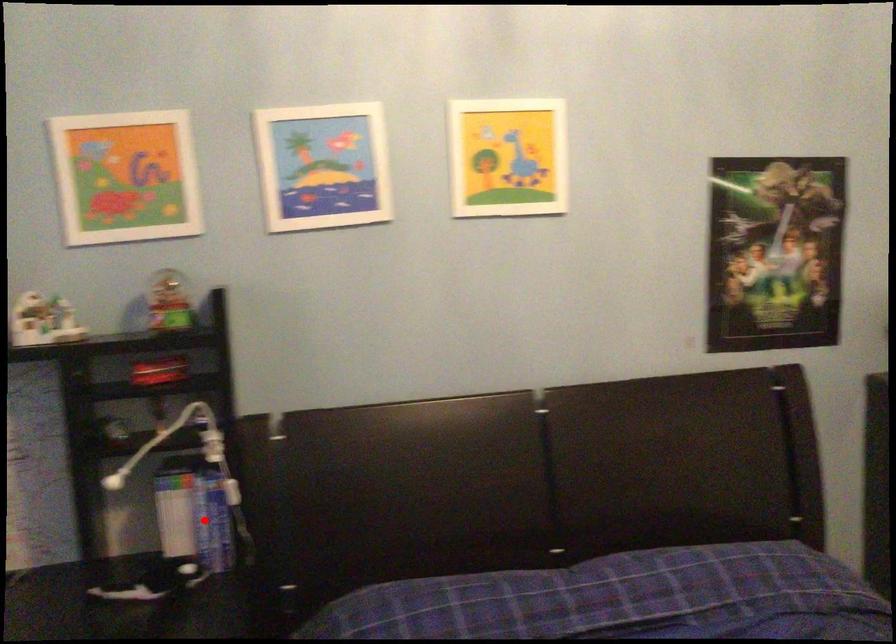
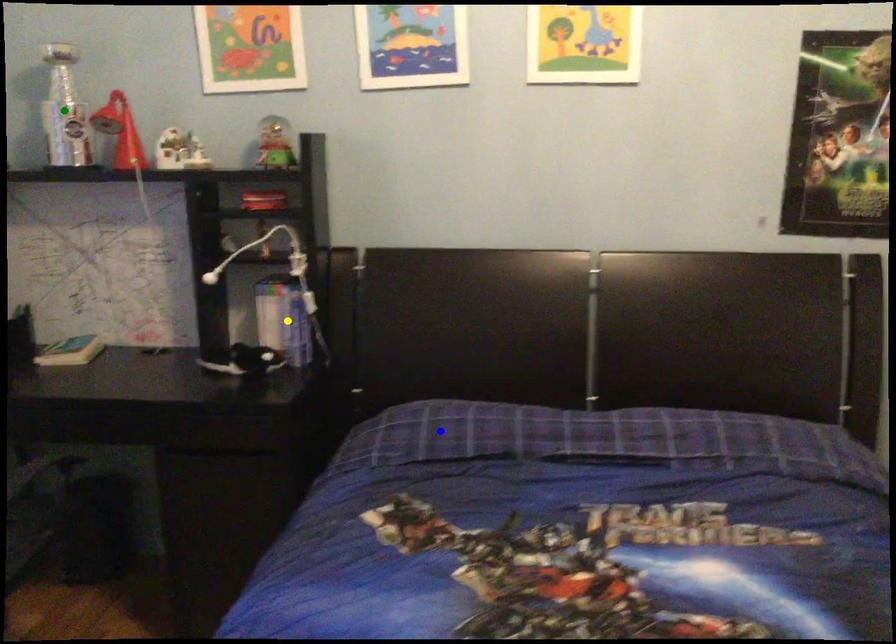
Question: I am providing you with two images of the same scene from different viewpoints. A red point is marked on the first image. You are given multiple points on the second image. In image 2, which mark is for the same physical point as the one in image 1?

Choices:
 (A) blue point
 (B) yellow point
 (C) green point

Answer: (B)